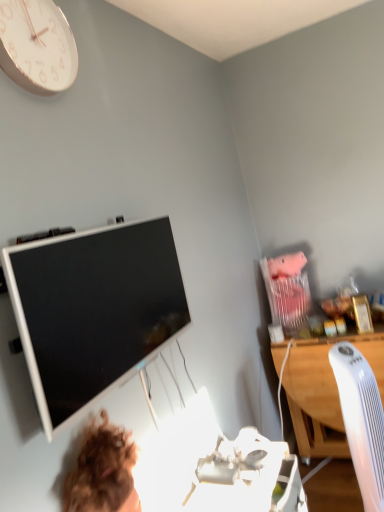
The width and height of the screenshot is (384, 512). What do you see at coordinates (93, 310) in the screenshot?
I see `white glossy television at upper left` at bounding box center [93, 310].

In order to click on white wood desk at right in this screenshot , I will do `click(324, 391)`.

Where is `white glossy clock at upper left`? The width and height of the screenshot is (384, 512). white glossy clock at upper left is located at coordinates (37, 46).

From a real-world perspective, is white plastic computer chair at right below white wood desk at right?

No, from a real-world perspective, white plastic computer chair at right is not under white wood desk at right.

In the scene shown: From the image's perspective, is white plastic computer chair at right on white wood desk at right?

Actually, white plastic computer chair at right appears below white wood desk at right in the image.

Which is in front, white plastic computer chair at right or white wood desk at right?

white plastic computer chair at right is more forward.

Does white plastic computer chair at right turn towards white wood desk at right?

No, white plastic computer chair at right is not oriented towards white wood desk at right.

Which is in front, white wood desk at right or white glossy television at upper left?

white glossy television at upper left.

Can you tell me how much white wood desk at right and white glossy television at upper left differ in facing direction?

The angular difference between white wood desk at right and white glossy television at upper left is 88.7 degrees.

Image resolution: width=384 pixels, height=512 pixels. In order to click on television located above the white wood desk at right (from the image's perspective) in this screenshot , I will do `click(93, 310)`.

Which point is more forward, [330,373] or [160,323]?

The point [160,323] is more forward.

Considering the positions of objects white plastic computer chair at right and white glossy clock at upper left in the image provided, who is behind, white plastic computer chair at right or white glossy clock at upper left?

white plastic computer chair at right is further from the camera.

I want to click on wall clock on the left of white plastic computer chair at right, so click(x=37, y=46).

Does point (350, 355) appear closer or farther from the camera than point (11, 4)?

Point (350, 355) appears to be farther away from the viewer than point (11, 4).

Is white plastic computer chair at right next to white glossy clock at upper left?

No, white plastic computer chair at right is not in contact with white glossy clock at upper left.

Is white glossy clock at upper left oriented away from white plastic computer chair at right?

No, white glossy clock at upper left's orientation is not away from white plastic computer chair at right.

Considering the sizes of objects white glossy clock at upper left and white plastic computer chair at right in the image provided, who is thinner, white glossy clock at upper left or white plastic computer chair at right?

Thinner between the two is white glossy clock at upper left.

Which is behind, white glossy clock at upper left or white plastic computer chair at right?

Positioned behind is white plastic computer chair at right.

Which is less distant, [66,55] or [353,420]?

The point [66,55] is more forward.

Who is shorter, white glossy television at upper left or white glossy clock at upper left?

white glossy clock at upper left.

From the picture: Is white glossy television at upper left not within white glossy clock at upper left?

white glossy television at upper left lies outside white glossy clock at upper left's area.

Considering the positions of objects white glossy television at upper left and white glossy clock at upper left in the image provided, who is more to the left, white glossy television at upper left or white glossy clock at upper left?

white glossy clock at upper left is more to the left.

Measure the distance between white plastic computer chair at right and white glossy television at upper left.

A distance of 38.94 inches exists between white plastic computer chair at right and white glossy television at upper left.

Is white plastic computer chair at right aimed at white glossy television at upper left?

No, white plastic computer chair at right is not turned towards white glossy television at upper left.

Is the depth of white plastic computer chair at right less than that of white glossy television at upper left?

No, white plastic computer chair at right is behind white glossy television at upper left.

Is white plastic computer chair at right in contact with white glossy television at upper left?

white plastic computer chair at right and white glossy television at upper left are clearly separated.

Considering the relative sizes of white glossy television at upper left and white wood desk at right in the image provided, is white glossy television at upper left wider than white wood desk at right?

Incorrect, the width of white glossy television at upper left does not surpass that of white wood desk at right.

Is the position of white glossy television at upper left more distant than that of white wood desk at right?

No, white glossy television at upper left is in front of white wood desk at right.

Would you say white glossy television at upper left is a long distance from white wood desk at right?

Yes, white glossy television at upper left and white wood desk at right are quite far apart.

The width and height of the screenshot is (384, 512). Identify the location of desk below the white plastic computer chair at right (from a real-world perspective). (324, 391).

Find the location of `television in front of the white wood desk at right`. television in front of the white wood desk at right is located at coordinates (93, 310).

Estimate the real-world distances between objects in this image. Which object is closer to white wood desk at right, white glossy clock at upper left or white plastic computer chair at right?

white plastic computer chair at right is positioned closer to the anchor white wood desk at right.

Estimate the real-world distances between objects in this image. Which object is further from white glossy clock at upper left, white plastic computer chair at right or white wood desk at right?

white wood desk at right is positioned further to the anchor white glossy clock at upper left.

When comparing their distances from white wood desk at right, does white plastic computer chair at right or white glossy television at upper left seem further?

The object further to white wood desk at right is white glossy television at upper left.

Considering their positions, is white plastic computer chair at right positioned closer to white glossy clock at upper left than white glossy television at upper left?

Among the two, white glossy television at upper left is located nearer to white glossy clock at upper left.

Based on their spatial positions, is white wood desk at right or white glossy clock at upper left closer to white plastic computer chair at right?

white wood desk at right is closer to white plastic computer chair at right.

Estimate the real-world distances between objects in this image. Which object is closer to white glossy television at upper left, white plastic computer chair at right or white wood desk at right?

white plastic computer chair at right is positioned closer to the anchor white glossy television at upper left.

Looking at the image, which one is located closer to white glossy clock at upper left, white glossy television at upper left or white wood desk at right?

white glossy television at upper left is closer to white glossy clock at upper left.

Considering their positions, is white glossy television at upper left positioned further to white wood desk at right than white plastic computer chair at right?

white glossy television at upper left lies further to white wood desk at right than the other object.

This screenshot has height=512, width=384. I want to click on desk between white glossy clock at upper left and white plastic computer chair at right in the up-down direction, so click(x=324, y=391).

Locate an element on the screen. Image resolution: width=384 pixels, height=512 pixels. television between white glossy clock at upper left and white plastic computer chair at right from top to bottom is located at coordinates (93, 310).

Where is `computer chair situated between white glossy television at upper left and white wood desk at right from left to right`? computer chair situated between white glossy television at upper left and white wood desk at right from left to right is located at coordinates (361, 421).

At what (x,y) coordinates should I click in order to perform the action: click on television situated between white glossy clock at upper left and white wood desk at right from left to right. Please return your answer as a coordinate pair (x, y). This screenshot has height=512, width=384. Looking at the image, I should click on (93, 310).